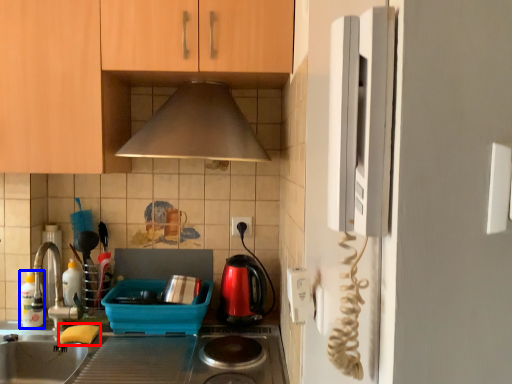
Question: Which object appears farthest to the camera in this image, food (highlighted by a red box) or bottle (highlighted by a blue box)?

Choices:
 (A) food
 (B) bottle

Answer: (B)